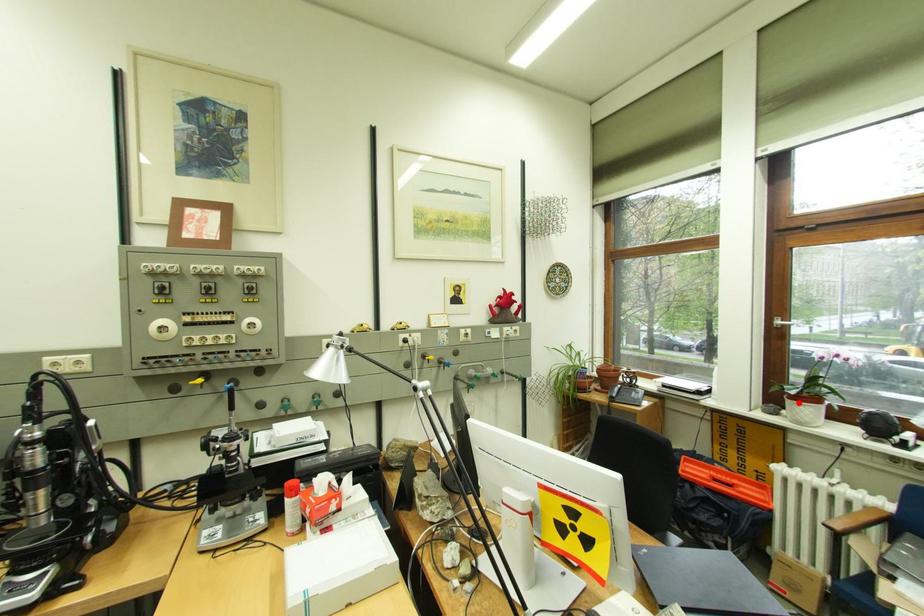
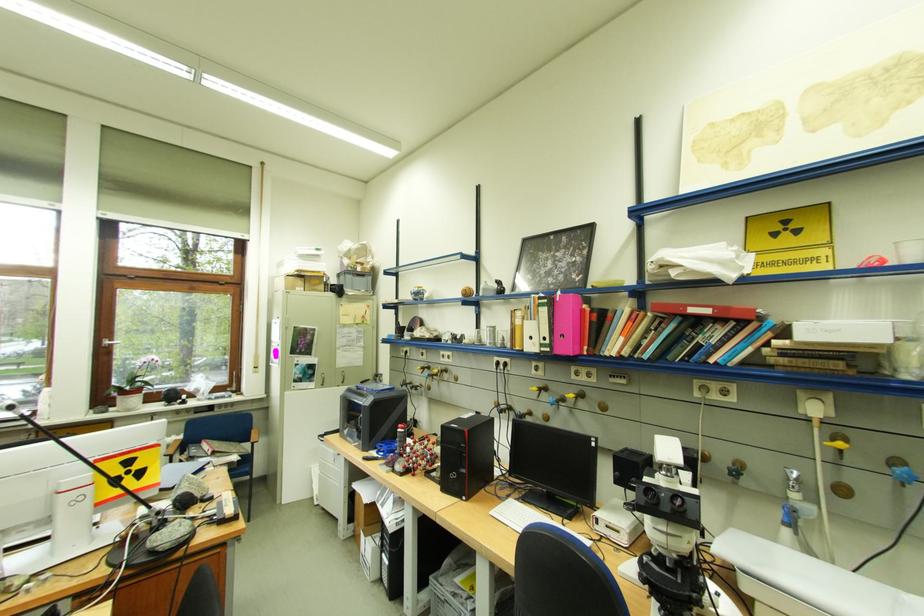
Locate, in the second image, the point that corresponds to the highlighted location in the first image.

(130, 399)